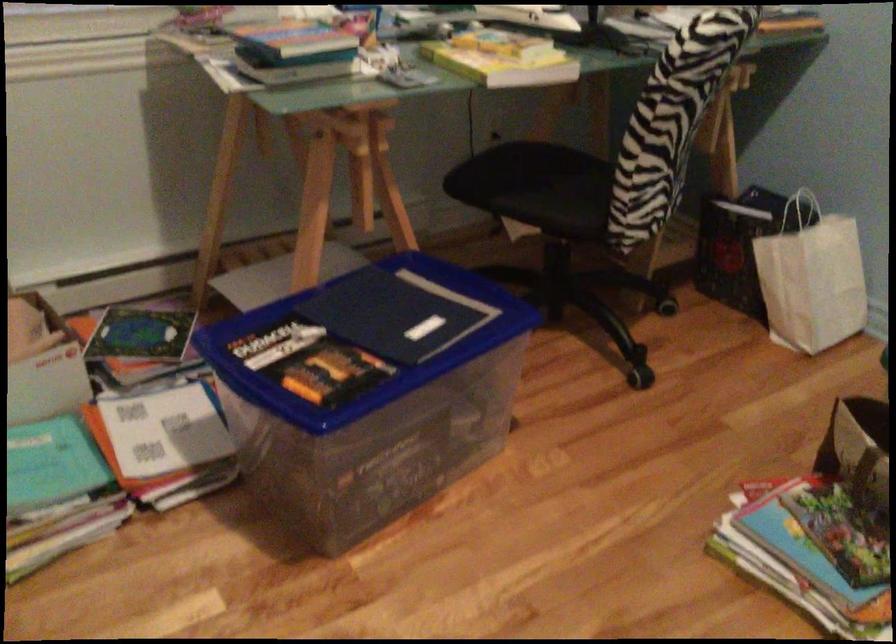
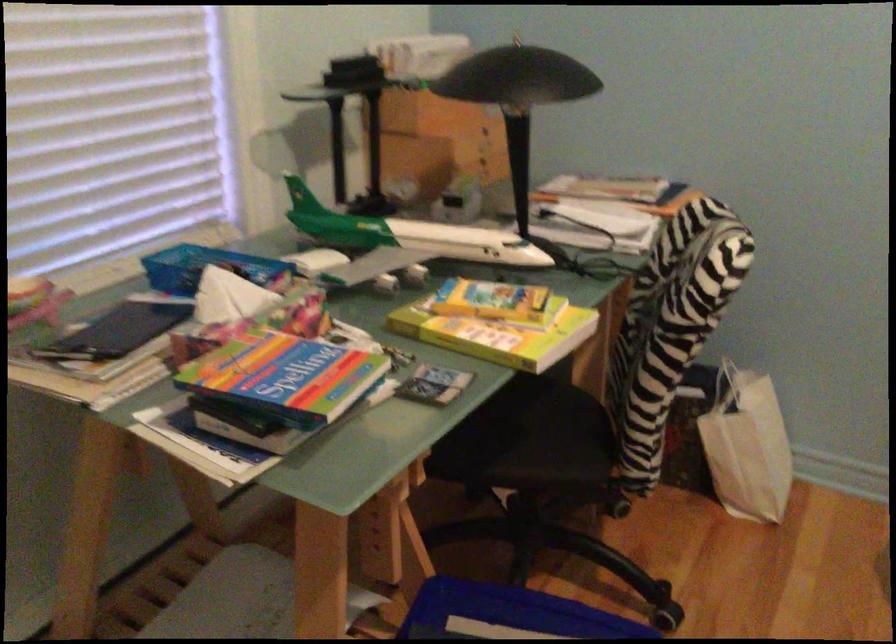
Where in the second image is the point corresponding to (x=788, y=269) from the first image?

(746, 446)